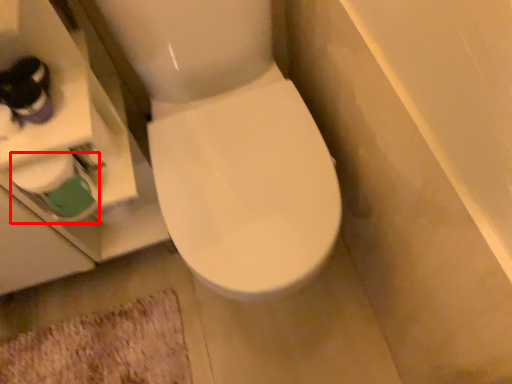
Question: From the image's perspective, what is the correct spatial positioning of toilet paper (annotated by the red box) in reference to bath mat?

Choices:
 (A) above
 (B) below

Answer: (A)